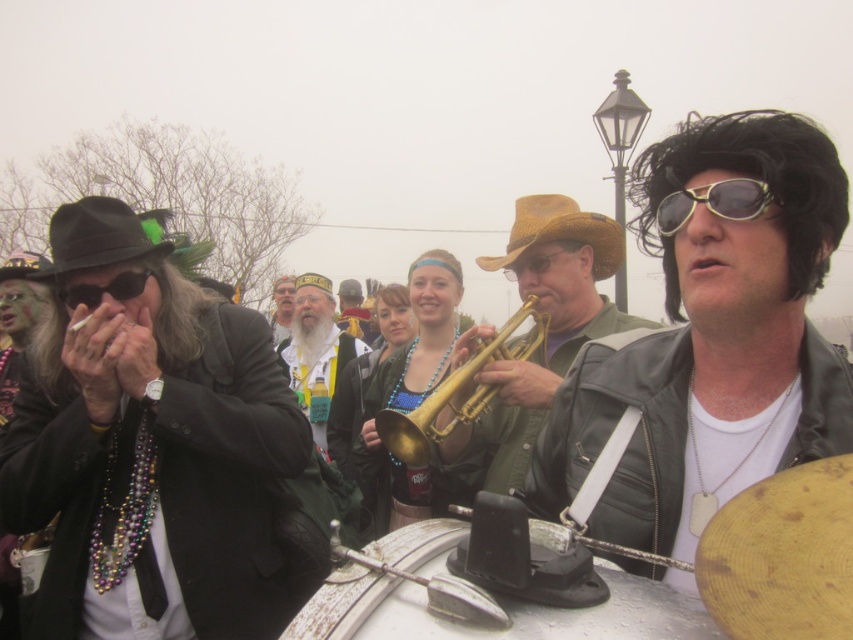
Question: Which of the following is the farthest from the observer?

Choices:
 (A) gold brass trumpet at center
 (B) yellow-green plastic sunglasses at upper right
 (C) white painted wood drum at center
 (D) brown felt cowboy hat at center

Answer: (D)

Question: Which of the following is the farthest from the observer?

Choices:
 (A) (561, 232)
 (B) (285, 300)
 (C) (88, 224)

Answer: (B)

Question: Does gold metallic trumpet at center have a greater width compared to brown felt cowboy hat at center?

Choices:
 (A) no
 (B) yes

Answer: (A)

Question: Can you confirm if gold metallic trumpet at center is positioned to the right of beige fabric hat at center?

Choices:
 (A) no
 (B) yes

Answer: (B)

Question: Observing the image, what is the correct spatial positioning of matte black goggles at left in reference to shiny gold trumpet at center?

Choices:
 (A) below
 (B) above

Answer: (A)

Question: Which point is farther to the camera?

Choices:
 (A) (369, 573)
 (B) (15, 262)
 (C) (341, 321)
 (D) (131, 227)

Answer: (C)